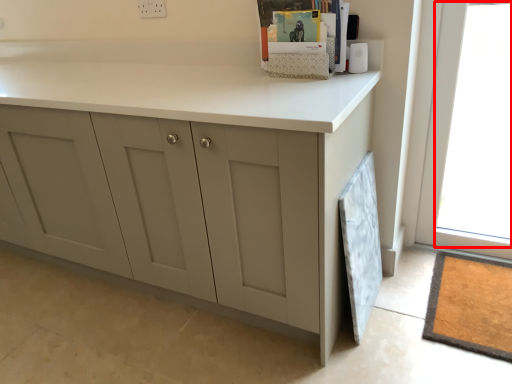
Question: From the image's perspective, considering the relative positions of window (annotated by the red box) and cabinetry in the image provided, where is window (annotated by the red box) located with respect to the staircase?

Choices:
 (A) below
 (B) above

Answer: (B)